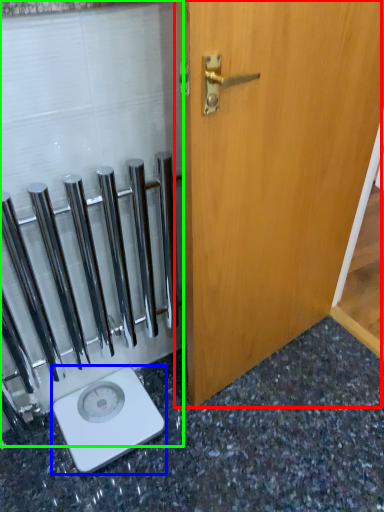
Question: Which is farther away from door (highlighted by a red box)? scale (highlighted by a blue box) or glass door (highlighted by a green box)?

Choices:
 (A) scale
 (B) glass door

Answer: (A)